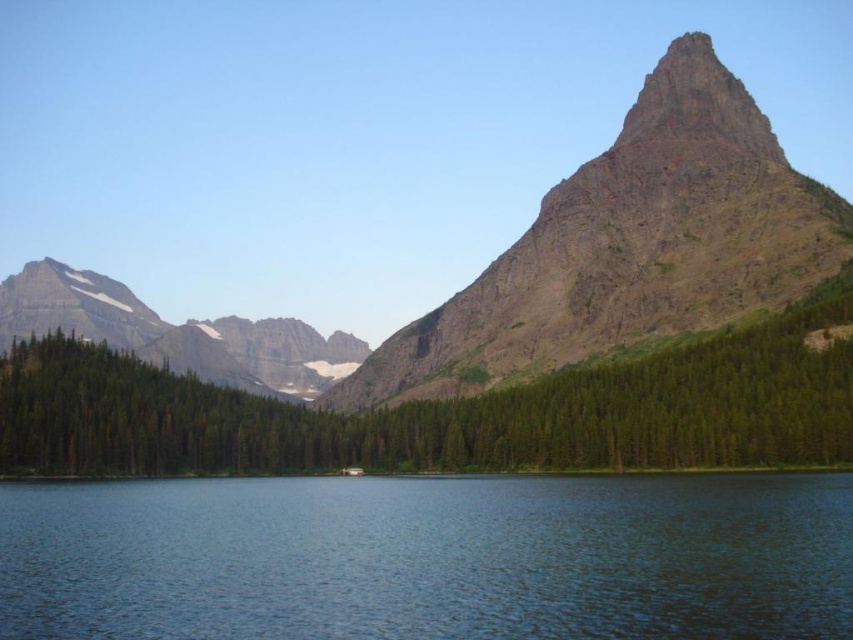
Question: Among these objects, which one is nearest to the camera?

Choices:
 (A) blue water at center
 (B) rugged granite mountain at center
 (C) green matte forest at center

Answer: (A)

Question: In this image, where is green matte forest at center located relative to rugged granite mountain at center?

Choices:
 (A) left
 (B) right

Answer: (B)

Question: Can you confirm if blue water at center is smaller than green matte forest at center?

Choices:
 (A) yes
 (B) no

Answer: (A)

Question: Can you confirm if green matte forest at center is smaller than rugged granite mountain at center?

Choices:
 (A) yes
 (B) no

Answer: (A)

Question: Among these points, which one is nearest to the camera?

Choices:
 (A) (785, 177)
 (B) (361, 609)

Answer: (B)

Question: Which object appears closest to the camera in this image?

Choices:
 (A) blue water at center
 (B) rugged granite mountain at center
 (C) green matte forest at center

Answer: (A)